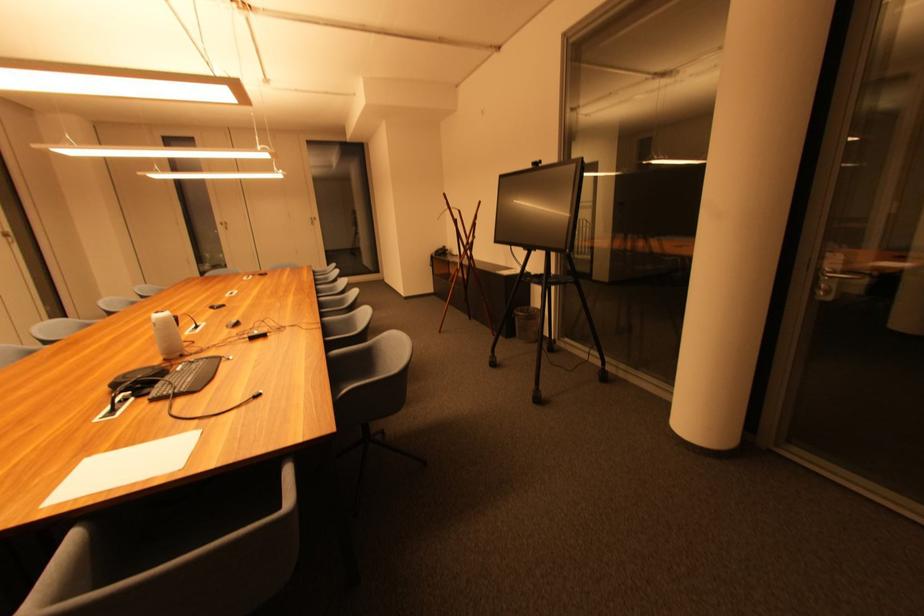
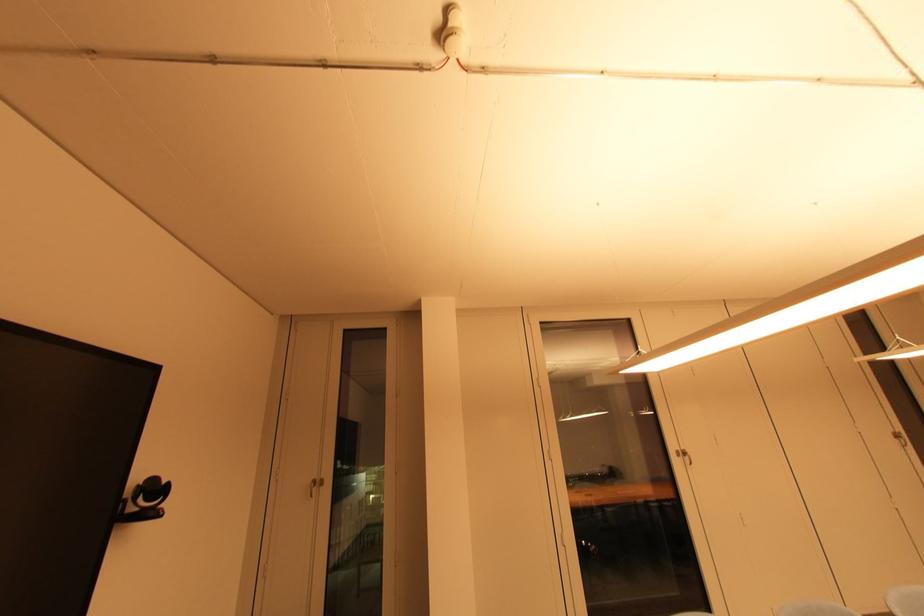
Question: Based on the continuous images, in which direction is the camera rotating? Reply with the corresponding letter.

Choices:
 (A) Left
 (B) Right
 (C) Up
 (D) Down

Answer: (A)